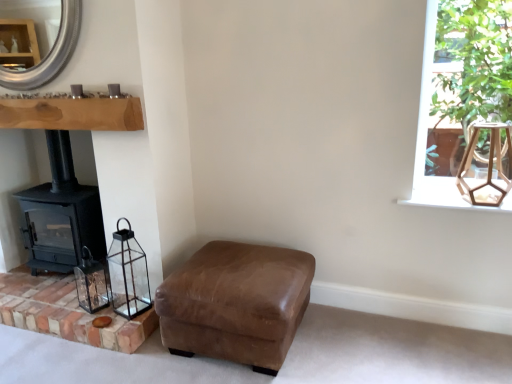
I want to click on free point to the left of clear glass lantern at lower left, acting as the first lamp starting from the left, so click(101, 308).